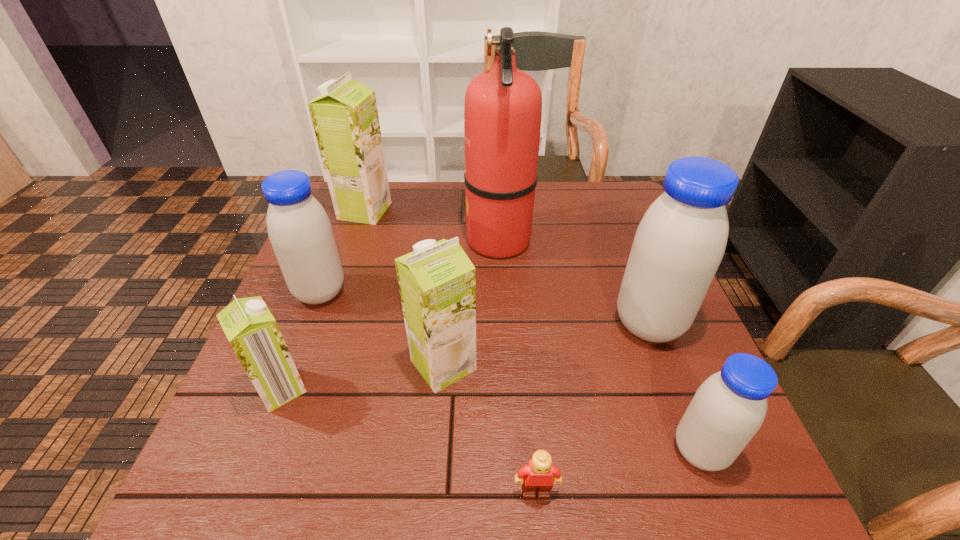
Where is `the nearest blue soya milk`? This screenshot has width=960, height=540. the nearest blue soya milk is located at coordinates (727, 410).

Where is `the nearest object`? The height and width of the screenshot is (540, 960). the nearest object is located at coordinates (537, 475).

Image resolution: width=960 pixels, height=540 pixels. Find the location of `brown Lego`. brown Lego is located at coordinates (537, 475).

Find the location of a particular element. The height and width of the screenshot is (540, 960). blank space located on the side of the fire extinguisher with the nozzle and handle is located at coordinates (355, 239).

Find the location of `free space located on the side of the fire extinguisher with the nozzle and handle`. free space located on the side of the fire extinguisher with the nozzle and handle is located at coordinates (363, 239).

This screenshot has height=540, width=960. What are the coordinates of `vacant region located on the side of the fire extinguisher with the nozzle and handle` in the screenshot? It's located at (373, 239).

The image size is (960, 540). Identify the location of free space located 0.150m on the right of the farthest green soya milk. (441, 211).

Where is `free space located 0.070m on the back of the biggest blue soya milk`? The width and height of the screenshot is (960, 540). free space located 0.070m on the back of the biggest blue soya milk is located at coordinates (632, 279).

Where is `vacant position located on the back of the second smallest green soya milk`? vacant position located on the back of the second smallest green soya milk is located at coordinates (452, 242).

Locate an element on the screen. The height and width of the screenshot is (540, 960). free spot located on the back of the leftmost blue soya milk is located at coordinates (346, 227).